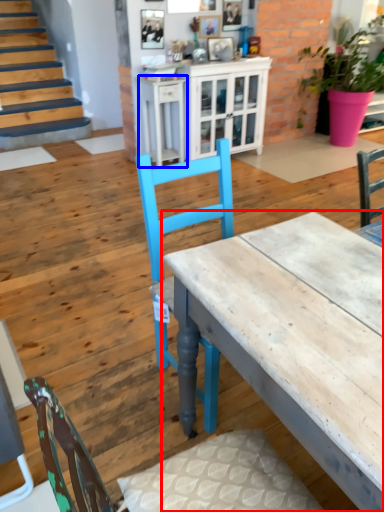
Question: Which object is further to the camera taking this photo, desk (highlighted by a red box) or table (highlighted by a blue box)?

Choices:
 (A) desk
 (B) table

Answer: (B)